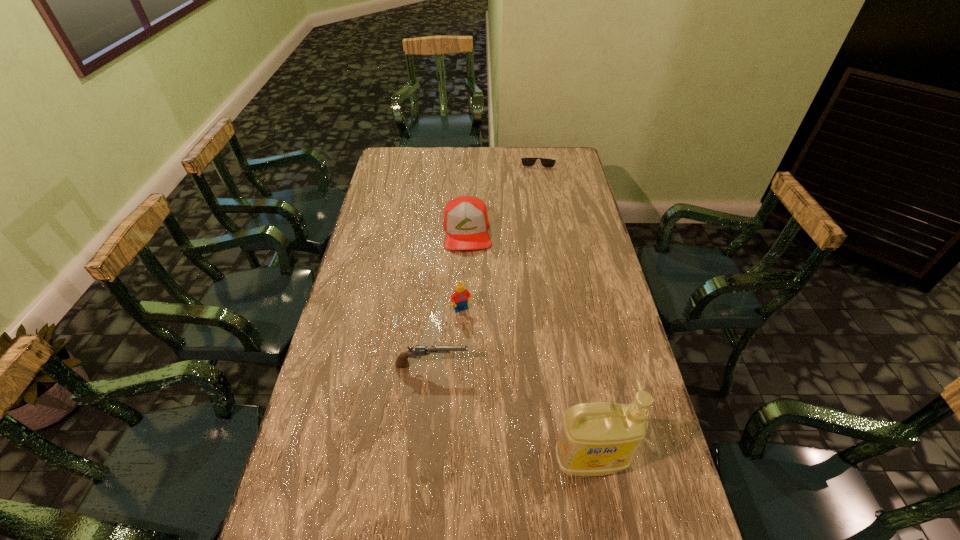
What are the coordinates of `vacant area between the second nearest object and the tallest object` in the screenshot? It's located at (511, 413).

This screenshot has width=960, height=540. Identify the location of empty location between the baseball cap and the nearest object. (528, 346).

This screenshot has height=540, width=960. In order to click on vacant region between the Lego and the gun in this screenshot , I will do `click(447, 338)`.

Find the location of a particular element. The width and height of the screenshot is (960, 540). free spot between the detergent and the fourth nearest object is located at coordinates (528, 346).

Identify the location of free area in between the sunglasses and the Lego. (500, 234).

Locate an element on the screen. vacant space in between the fourth tallest object and the detergent is located at coordinates (511, 413).

You are a GUI agent. You are given a task and a screenshot of the screen. Output one action in this format:
    pyautogui.click(x=<x>, y=<y>)
    Task: Click on the free area in between the second shortest object and the second farthest object
    The height and width of the screenshot is (540, 960).
    Given the screenshot: What is the action you would take?
    pyautogui.click(x=449, y=298)

This screenshot has width=960, height=540. I want to click on vacant area that lies between the fourth nearest object and the third nearest object, so click(x=465, y=271).

Identify the location of free space between the tallest object and the second shortest object. Image resolution: width=960 pixels, height=540 pixels. (511, 413).

Locate which object ranks third in proximity to the gun. Please provide its 2D coordinates. Your answer should be formatted as a tuple, i.e. [(x, y)], where the tuple contains the x and y coordinates of a point satisfying the conditions above.

[(466, 223)]